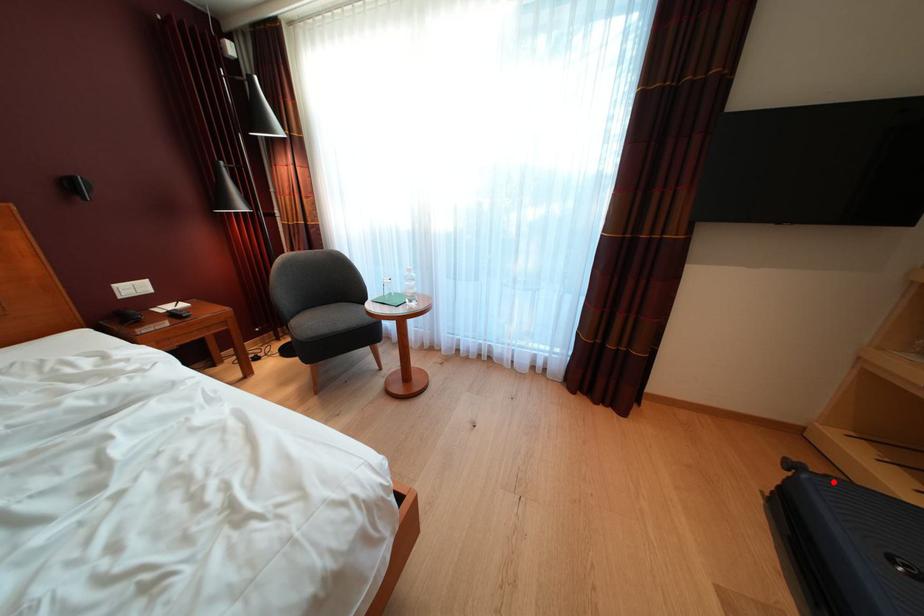
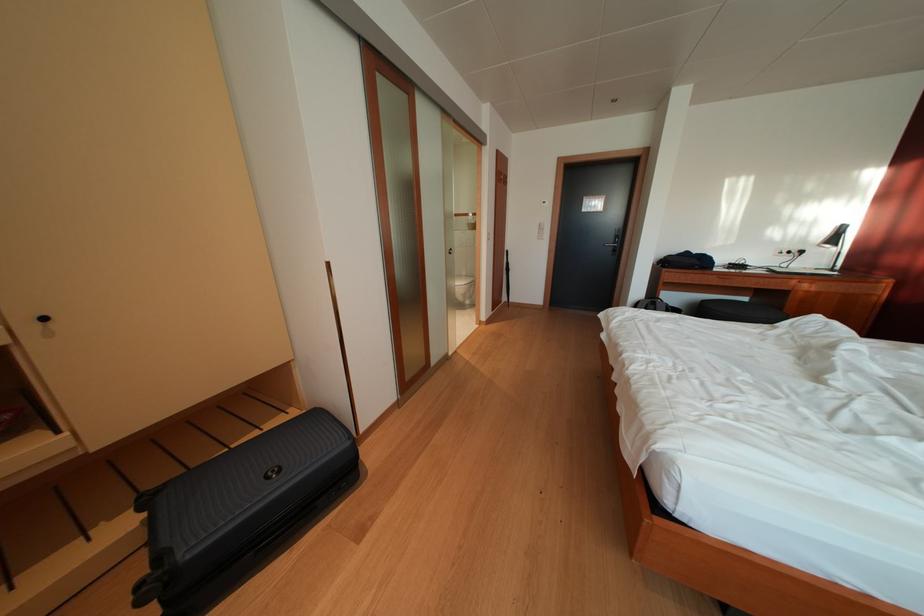
Find the pixel in the second image that matches the highlighted location in the first image.

(167, 562)